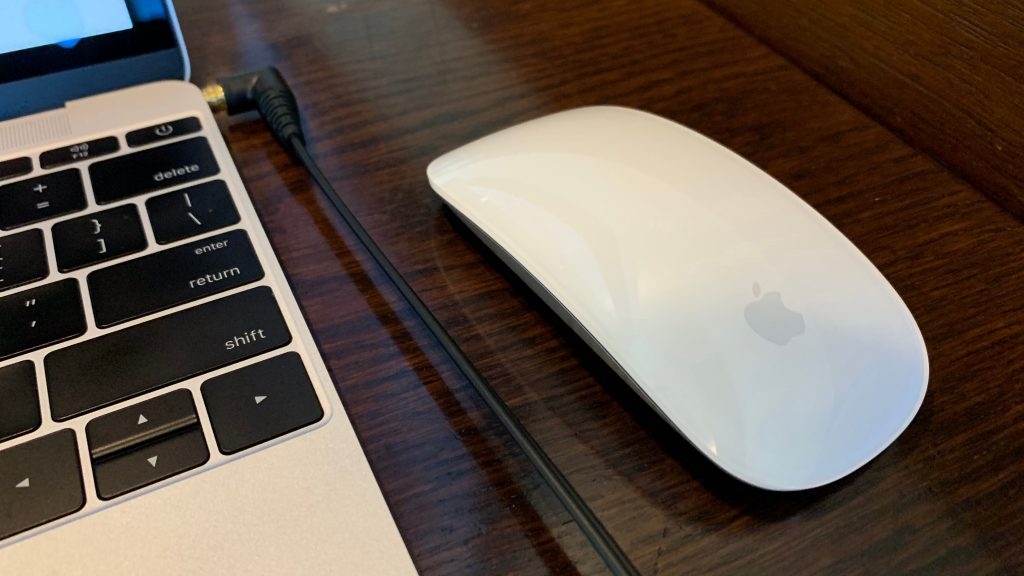
Find the location of a particular element. laptop is located at coordinates (145, 335).